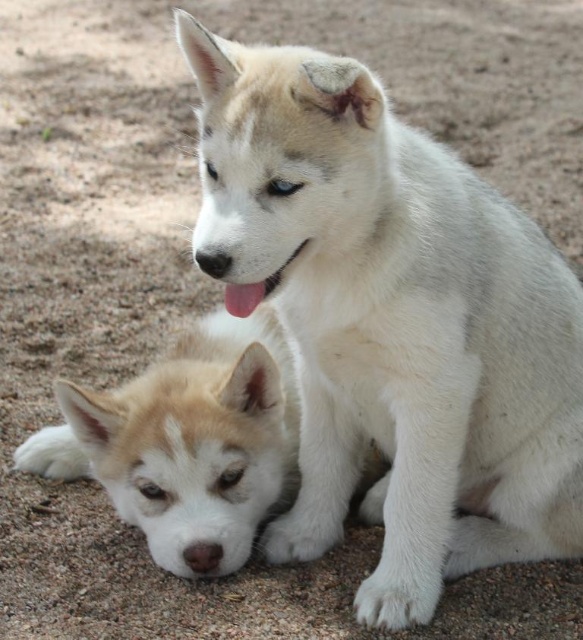
Question: Does white fur dog at center appear under fuzzy white puppy at lower left?

Choices:
 (A) yes
 (B) no

Answer: (B)

Question: Which point appears closest to the camera in this image?

Choices:
 (A) (451, 451)
 (B) (34, 442)

Answer: (A)

Question: Among these objects, which one is nearest to the camera?

Choices:
 (A) white fur dog at center
 (B) fuzzy white puppy at lower left

Answer: (A)

Question: Does white fur dog at center lie in front of fuzzy white puppy at lower left?

Choices:
 (A) yes
 (B) no

Answer: (A)

Question: Does white fur dog at center appear on the left side of fuzzy white puppy at lower left?

Choices:
 (A) no
 (B) yes

Answer: (A)

Question: Which of the following is the farthest from the observer?

Choices:
 (A) (244, 552)
 (B) (367, 188)

Answer: (A)